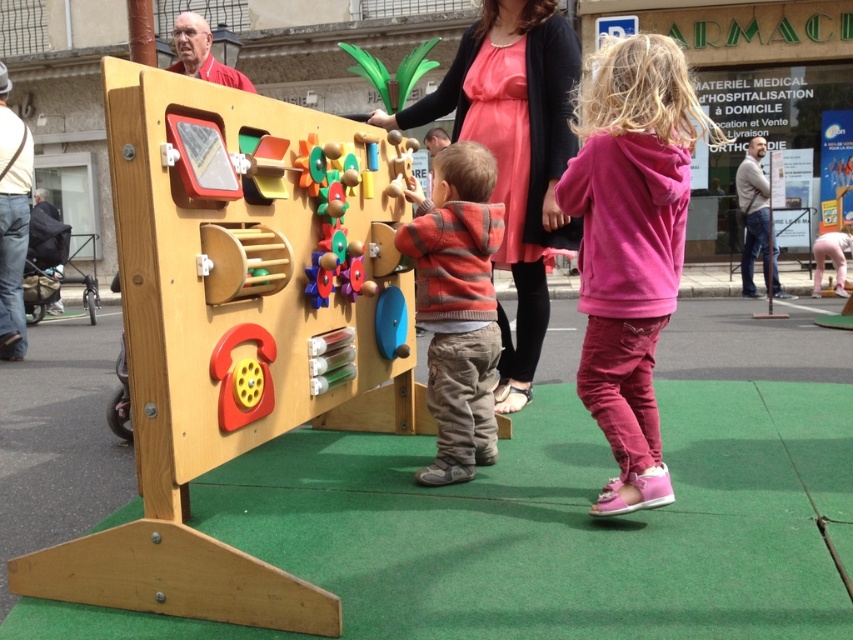
Question: Is the position of pink fleece hoodie at right less distant than that of striped sweater at center?

Choices:
 (A) yes
 (B) no

Answer: (A)

Question: Is matte pink dress at center to the right of striped sweater at center from the viewer's perspective?

Choices:
 (A) no
 (B) yes

Answer: (B)

Question: Considering the real-world distances, which object is closest to the pink fleece hoodie at right?

Choices:
 (A) matte pink dress at center
 (B) striped sweater at center

Answer: (B)

Question: Which object is positioned closest to the matte pink dress at center?

Choices:
 (A) pink fleece hoodie at right
 (B) striped sweater at center

Answer: (B)

Question: Can you confirm if pink fleece hoodie at right is positioned to the right of striped sweater at center?

Choices:
 (A) no
 (B) yes

Answer: (B)

Question: Which object is positioned farthest from the striped sweater at center?

Choices:
 (A) pink fleece hoodie at right
 (B) matte pink dress at center

Answer: (A)